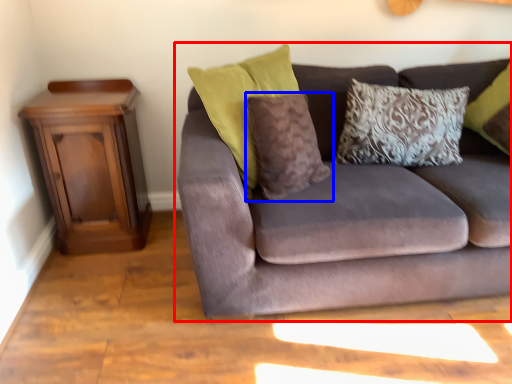
Question: Among these objects, which one is nearest to the camera, studio couch (highlighted by a red box) or pillow (highlighted by a blue box)?

Choices:
 (A) studio couch
 (B) pillow

Answer: (A)